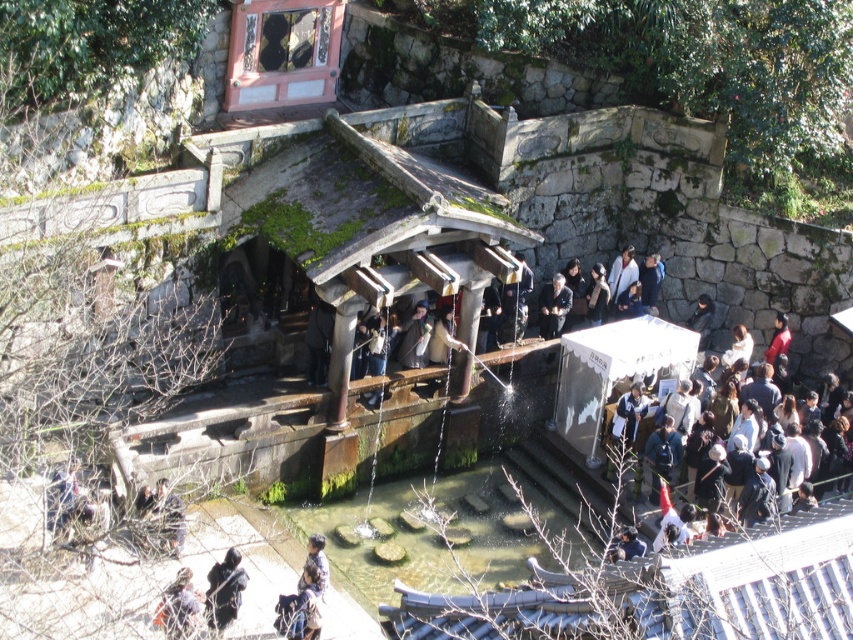
Question: Can you confirm if dark brown hair at lower left is wider than white fabric bag at center?

Choices:
 (A) no
 (B) yes

Answer: (A)

Question: In this image, where is dark brown hair at lower left located relative to dark blue uniform at center?

Choices:
 (A) right
 (B) left

Answer: (B)

Question: Is dark gray fabric crowd at lower right bigger than dark blue fabric at lower left?

Choices:
 (A) no
 (B) yes

Answer: (A)

Question: Among these points, which one is farthest from the camera?

Choices:
 (A) (631, 252)
 (B) (320, 323)

Answer: (A)

Question: Which point is closer to the camera taking this photo?

Choices:
 (A) (608, 305)
 (B) (228, 614)

Answer: (B)

Question: Which point appears closest to the camera in this image?

Choices:
 (A) [177, 605]
 (B) [321, 372]
 (C) [705, 324]

Answer: (A)